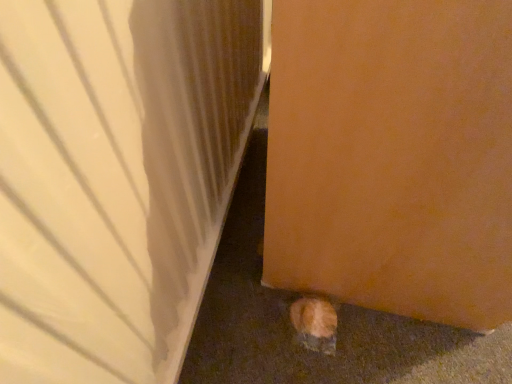
Question: Does orange fur cat at lower right appear on the right side of matte wood door at lower right, acting as the 2th door starting from the right?

Choices:
 (A) yes
 (B) no

Answer: (A)

Question: Is the depth of orange fur cat at lower right greater than that of matte wood door at lower right, acting as the 2th door starting from the right?

Choices:
 (A) no
 (B) yes

Answer: (B)

Question: Is orange fur cat at lower right shorter than matte wood door at lower right, acting as the 2th door starting from the right?

Choices:
 (A) yes
 (B) no

Answer: (A)

Question: Does orange fur cat at lower right have a lesser width compared to matte wood door at lower right, positioned as the first door in left-to-right order?

Choices:
 (A) no
 (B) yes

Answer: (B)

Question: From a real-world perspective, is orange fur cat at lower right beneath matte wood door at lower right, positioned as the first door in left-to-right order?

Choices:
 (A) yes
 (B) no

Answer: (A)

Question: From a real-world perspective, is orange fur cat at lower right over matte wood door at lower right, acting as the 2th door starting from the right?

Choices:
 (A) yes
 (B) no

Answer: (B)

Question: Is matte wood door at lower right, positioned as the first door in left-to-right order, beside orange matte door at lower right, the 2th door from the left?

Choices:
 (A) yes
 (B) no

Answer: (B)

Question: Is matte wood door at lower right, positioned as the first door in left-to-right order, thinner than orange matte door at lower right, which appears as the 1th door when viewed from the right?

Choices:
 (A) no
 (B) yes

Answer: (B)

Question: Does matte wood door at lower right, positioned as the first door in left-to-right order, come in front of orange matte door at lower right, which appears as the 1th door when viewed from the right?

Choices:
 (A) yes
 (B) no

Answer: (A)

Question: Is matte wood door at lower right, acting as the 2th door starting from the right, facing towards orange matte door at lower right, which appears as the 1th door when viewed from the right?

Choices:
 (A) no
 (B) yes

Answer: (B)

Question: Is the depth of matte wood door at lower right, positioned as the first door in left-to-right order, greater than that of orange matte door at lower right, the 2th door from the left?

Choices:
 (A) yes
 (B) no

Answer: (B)

Question: Can you confirm if matte wood door at lower right, acting as the 2th door starting from the right, is bigger than orange matte door at lower right, which appears as the 1th door when viewed from the right?

Choices:
 (A) no
 (B) yes

Answer: (A)

Question: From the image's perspective, is matte wood door at lower right, acting as the 2th door starting from the right, located beneath orange fur cat at lower right?

Choices:
 (A) yes
 (B) no

Answer: (B)